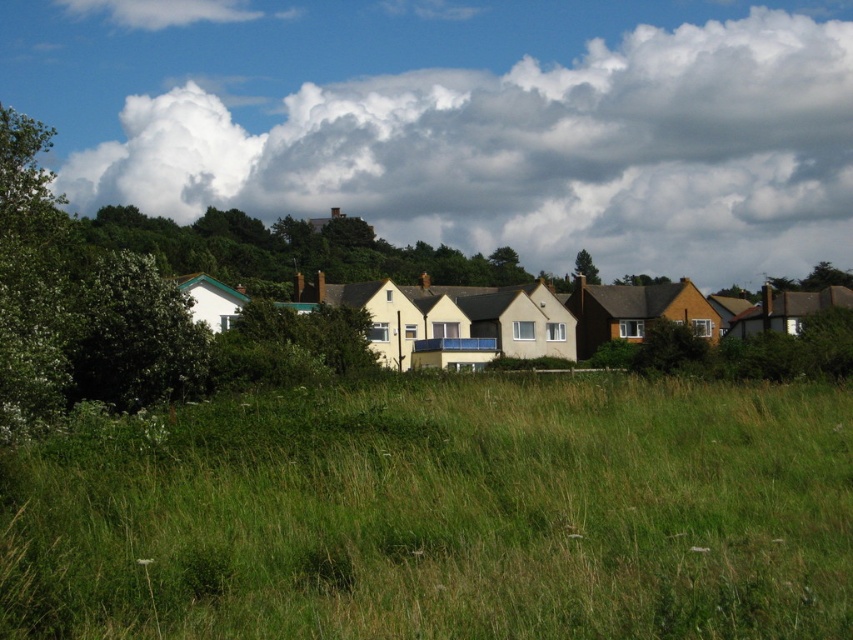
Question: Which of the following is the farthest from the observer?

Choices:
 (A) (814, 170)
 (B) (782, 634)

Answer: (A)

Question: Does green grass at center lie behind white fluffy cloud at upper center?

Choices:
 (A) no
 (B) yes

Answer: (A)

Question: Does green grass at center have a lesser width compared to green leafy tree at center?

Choices:
 (A) yes
 (B) no

Answer: (A)

Question: Which of the following is the closest to the observer?

Choices:
 (A) (225, 132)
 (B) (579, 253)

Answer: (B)

Question: Where is green grass at center located in relation to green leafy tree at center in the image?

Choices:
 (A) left
 (B) right

Answer: (A)

Question: Which point is farther from the camera taking this photo?

Choices:
 (A) click(148, 480)
 (B) click(111, 42)

Answer: (B)